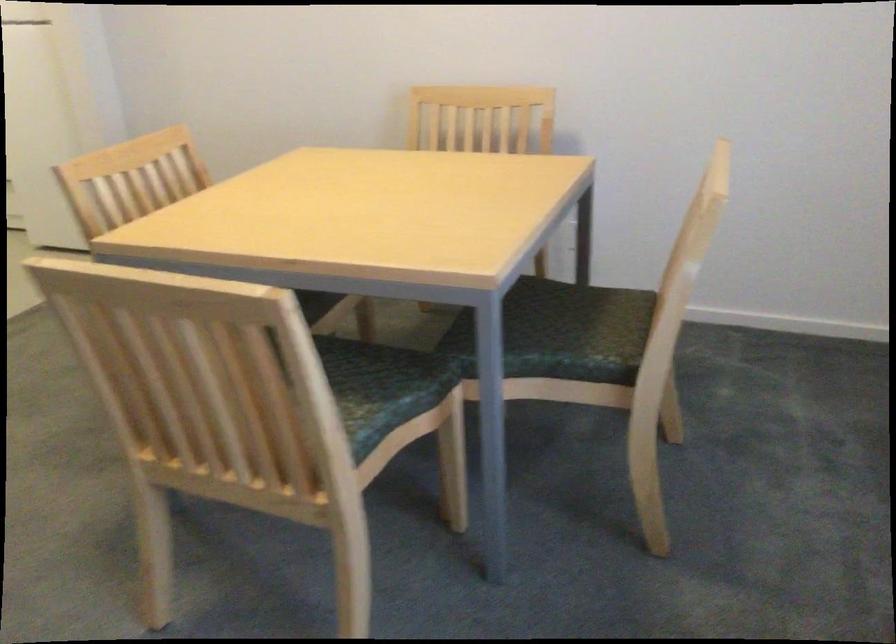
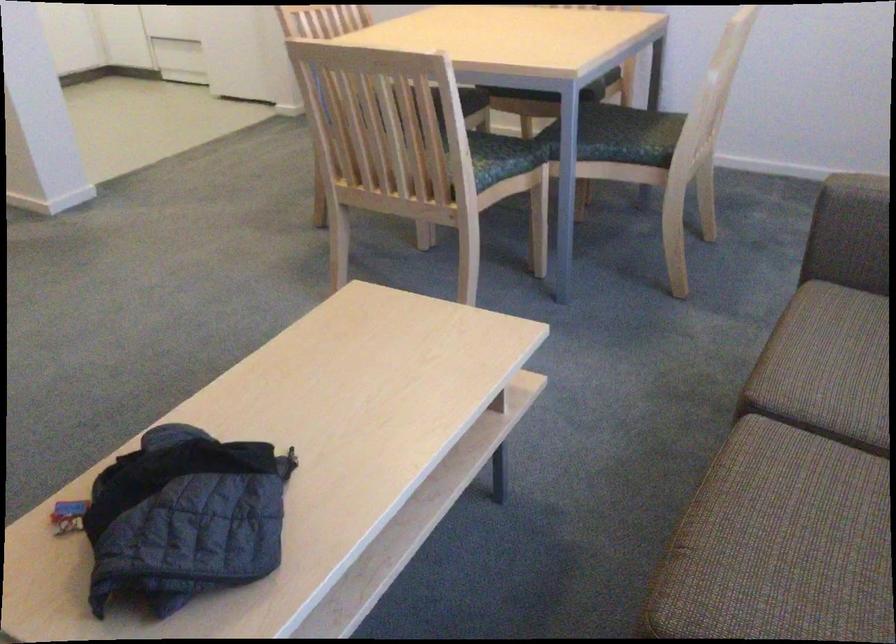
Where in the second image is the point corresponding to (x=556, y=339) from the first image?

(619, 135)